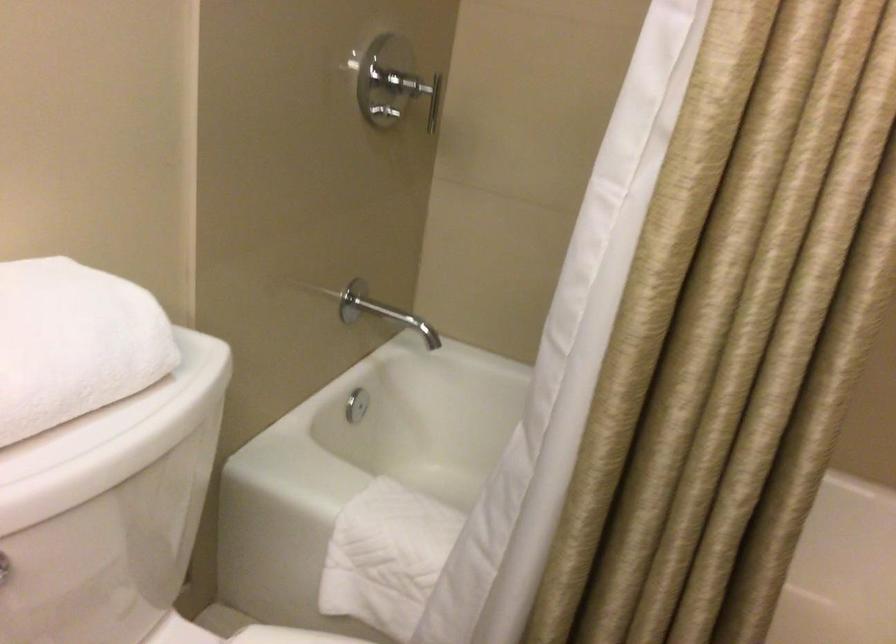
You are a GUI agent. You are given a task and a screenshot of the screen. Output one action in this format:
    pyautogui.click(x=<x>, y=<y>)
    Task: Click on the shower control handle
    
    Given the screenshot: What is the action you would take?
    pyautogui.click(x=432, y=91)